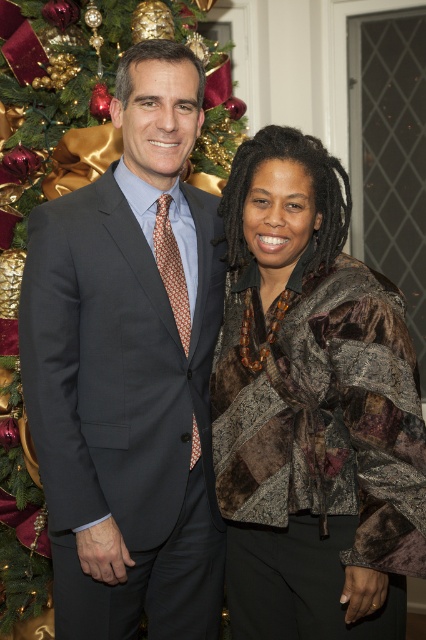
Question: Which object is farther from the camera taking this photo?

Choices:
 (A) brown patchwork jacket at center
 (B) dark gray suit at center

Answer: (B)

Question: Is dark gray suit at center above brown patchwork jacket at center?

Choices:
 (A) yes
 (B) no

Answer: (A)

Question: Which point appears farthest from the camera in this image?

Choices:
 (A) (268, 308)
 (B) (187, 618)

Answer: (B)

Question: Does dark gray suit at center have a greater width compared to brown patchwork jacket at center?

Choices:
 (A) yes
 (B) no

Answer: (B)

Question: Can you confirm if dark gray suit at center is positioned to the left of brown patchwork jacket at center?

Choices:
 (A) no
 (B) yes

Answer: (B)